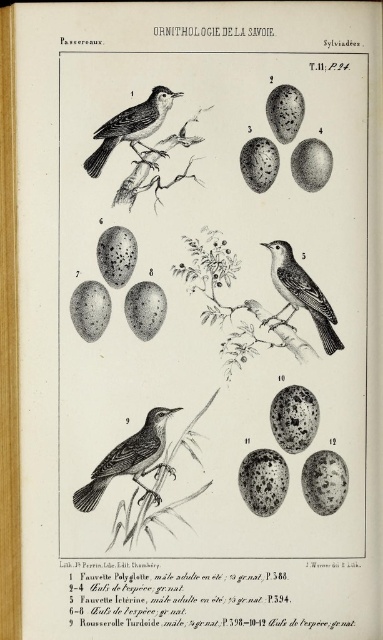
Image resolution: width=383 pixels, height=640 pixels. Describe the element at coordinates (127, 460) in the screenshot. I see `brown textured bird at center` at that location.

You are a GUI agent. You are given a task and a screenshot of the screen. Output one action in this format:
    pyautogui.click(x=<x>, y=<y>)
    Task: Click on the brown textured bird at center
    The width and height of the screenshot is (383, 640).
    Given the screenshot: What is the action you would take?
    pyautogui.click(x=127, y=460)

This screenshot has height=640, width=383. I want to click on brown textured bird at center, so click(x=127, y=460).

Who is positioned more to the left, smooth black bird at center or smooth black bird at upper left?

smooth black bird at upper left is more to the left.

Is point (325, 349) farther from camera compared to point (106, 138)?

Yes, it is behind point (106, 138).

The height and width of the screenshot is (640, 383). In order to click on smooth black bird at center in this screenshot , I will do `click(302, 292)`.

This screenshot has height=640, width=383. Identify the location of smooth black bird at center. (302, 292).

Between point (147, 456) and point (271, 259), which one is positioned in front?

Point (147, 456) is more forward.

Consider the image. Which of these two, brown textured bird at center or smooth black bird at center, stands shorter?

brown textured bird at center is shorter.

The image size is (383, 640). Find the location of `brown textured bird at center`. brown textured bird at center is located at coordinates (127, 460).